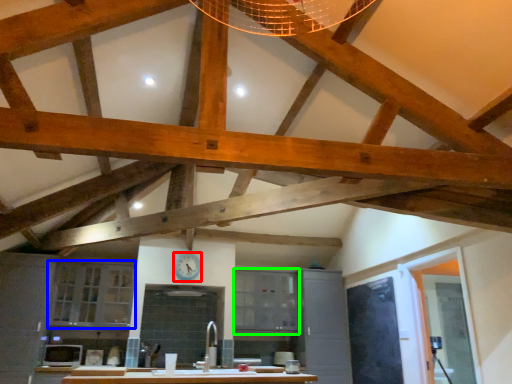
Question: Considering the real-world distances, which object is farthest from clock (highlighted by a red box)? cabinetry (highlighted by a blue box) or cabinetry (highlighted by a green box)?

Choices:
 (A) cabinetry
 (B) cabinetry

Answer: (A)